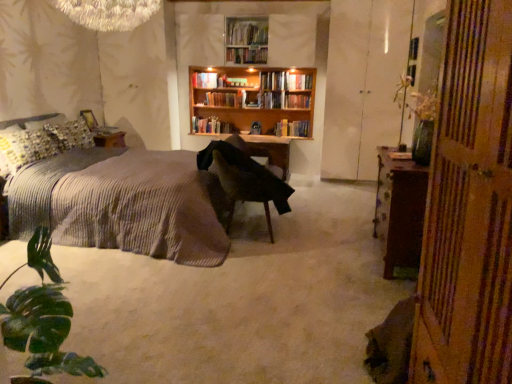
Question: Does hardcover book at center, marked as the 2th book in a top-to-bottom arrangement, come behind hardcover book at center, arranged as the 3th book when viewed from the top?

Choices:
 (A) yes
 (B) no

Answer: (A)

Question: From a real-world perspective, is hardcover book at center, marked as the 2th book in a top-to-bottom arrangement, located beneath hardcover book at center, acting as the 3th book starting from the bottom?

Choices:
 (A) no
 (B) yes

Answer: (A)

Question: Is hardcover book at center, positioned as the fourth book in bottom-to-top order, closer to the viewer compared to hardcover book at center, acting as the 3th book starting from the bottom?

Choices:
 (A) yes
 (B) no

Answer: (B)

Question: Does hardcover book at center, positioned as the fourth book in bottom-to-top order, appear on the right side of hardcover book at center, arranged as the 3th book when viewed from the top?

Choices:
 (A) no
 (B) yes

Answer: (A)

Question: Can you confirm if hardcover book at center, positioned as the fourth book in bottom-to-top order, is positioned to the left of hardcover book at center, arranged as the 3th book when viewed from the top?

Choices:
 (A) yes
 (B) no

Answer: (A)

Question: Would you say white glossy cabinet at right is inside or outside hardcover books at center, the 1th book when ordered from bottom to top?

Choices:
 (A) outside
 (B) inside

Answer: (A)

Question: In the image, is white glossy cabinet at right positioned in front of or behind hardcover books at center, the fifth book when ordered from top to bottom?

Choices:
 (A) front
 (B) behind

Answer: (A)

Question: From the image's perspective, is white glossy cabinet at right positioned above or below hardcover books at center, the 1th book when ordered from bottom to top?

Choices:
 (A) below
 (B) above

Answer: (B)

Question: In terms of size, does white glossy cabinet at right appear bigger or smaller than hardcover books at center, the 1th book when ordered from bottom to top?

Choices:
 (A) small
 (B) big

Answer: (B)

Question: Choose the correct answer: Is wooden bookshelf at center, the 1th book viewed from the top, inside wooden table at center or outside it?

Choices:
 (A) outside
 (B) inside

Answer: (A)

Question: From a real-world perspective, is wooden bookshelf at center, which is counted as the 5th book, starting from the bottom, positioned above or below wooden table at center?

Choices:
 (A) above
 (B) below

Answer: (A)

Question: Is wooden bookshelf at center, the 1th book viewed from the top, taller or shorter than wooden table at center?

Choices:
 (A) tall
 (B) short

Answer: (B)

Question: Is point click(252, 54) positioned closer to the camera than point click(236, 145)?

Choices:
 (A) closer
 (B) farther

Answer: (B)

Question: Is point (241, 62) closer or farther from the camera than point (488, 142)?

Choices:
 (A) closer
 (B) farther

Answer: (B)

Question: From a real-world perspective, is wooden bookshelf at center, the 1th book viewed from the top, above or below green glass vase at right?

Choices:
 (A) below
 (B) above

Answer: (B)